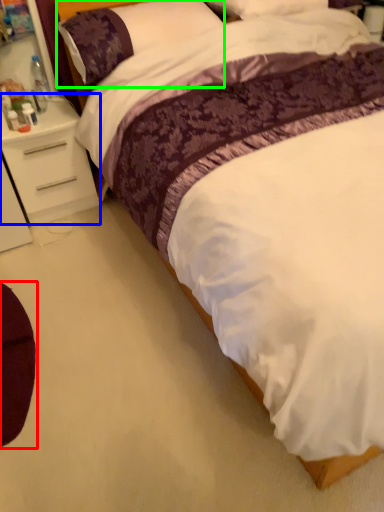
Question: Which object is positioned closest to swivel chair (highlighted by a red box)? Select from nightstand (highlighted by a blue box) and pillow (highlighted by a green box).

Choices:
 (A) nightstand
 (B) pillow

Answer: (A)